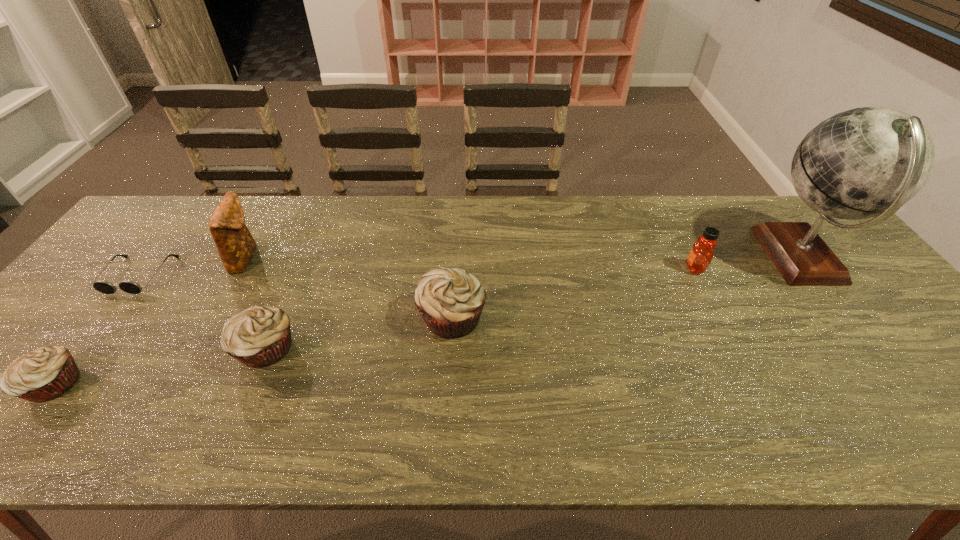
With all muffins evenly spaced, where should an extra muffin be placed on the right to continue the pattern? Please point out a vacant space. Please provide its 2D coordinates. Your answer should be formatted as a tuple, i.e. [(x, y)], where the tuple contains the x and y coordinates of a point satisfying the conditions above.

[(616, 289)]